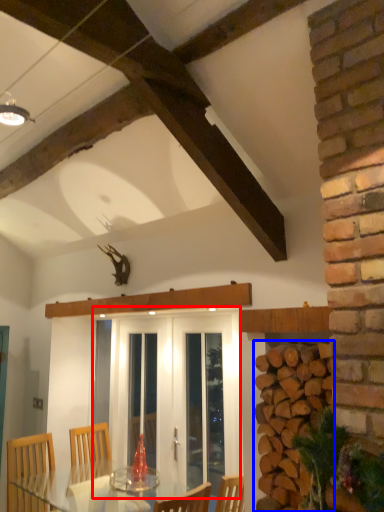
Question: Which object is further to the camera taking this photo, screen door (highlighted by a red box) or brickwork (highlighted by a blue box)?

Choices:
 (A) screen door
 (B) brickwork

Answer: (A)